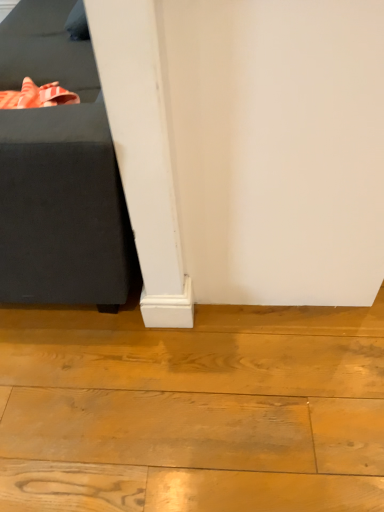
Question: Does natural wood floor at lower left have a larger size compared to black fabric ottoman at left?

Choices:
 (A) no
 (B) yes

Answer: (A)

Question: Can black fabric ottoman at left be found inside natural wood floor at lower left?

Choices:
 (A) no
 (B) yes

Answer: (A)

Question: Is natural wood floor at lower left taller than black fabric ottoman at left?

Choices:
 (A) yes
 (B) no

Answer: (B)

Question: Is natural wood floor at lower left positioned with its back to black fabric ottoman at left?

Choices:
 (A) no
 (B) yes

Answer: (A)

Question: Considering the relative positions of natural wood floor at lower left and black fabric ottoman at left in the image provided, is natural wood floor at lower left to the left of black fabric ottoman at left from the viewer's perspective?

Choices:
 (A) no
 (B) yes

Answer: (A)

Question: Is the depth of natural wood floor at lower left greater than that of black fabric ottoman at left?

Choices:
 (A) yes
 (B) no

Answer: (A)

Question: Does black fabric ottoman at left have a greater height compared to natural wood floor at lower left?

Choices:
 (A) no
 (B) yes

Answer: (B)

Question: Is black fabric ottoman at left facing away from natural wood floor at lower left?

Choices:
 (A) yes
 (B) no

Answer: (B)

Question: Is black fabric ottoman at left outside of natural wood floor at lower left?

Choices:
 (A) yes
 (B) no

Answer: (A)

Question: From the image's perspective, is black fabric ottoman at left beneath natural wood floor at lower left?

Choices:
 (A) no
 (B) yes

Answer: (A)

Question: Can you confirm if black fabric ottoman at left is bigger than natural wood floor at lower left?

Choices:
 (A) yes
 (B) no

Answer: (A)

Question: Can you confirm if black fabric ottoman at left is wider than natural wood floor at lower left?

Choices:
 (A) no
 (B) yes

Answer: (A)

Question: Is point (64, 161) positioned closer to the camera than point (77, 459)?

Choices:
 (A) farther
 (B) closer

Answer: (B)